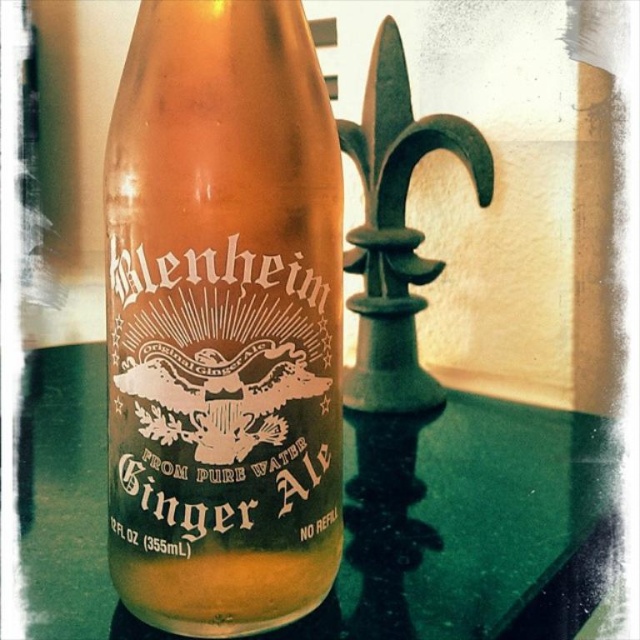
In the scene shown: You are a quality inspector checking the Glenheim Ginger Ale bottle. You need to verify if the liquid inside reaches the point at coordinates [221,320]. Based on the bottle design, can you confirm if the liquid is at that point?

The liquid inside the bottle at point [221,320] is present because the description states that at this point lies the translucent amber glass ginger ale at center.

You are holding the green glass bottle at center and want to pour its contents into a cup. Which direction should you tilt the bottle to ensure the translucent amber glass ginger ale at center flows out smoothly?

The translucent amber glass ginger ale at center is located above the green glass bottle at center, so tilting the bottle downward would allow the ginger ale to flow out smoothly.